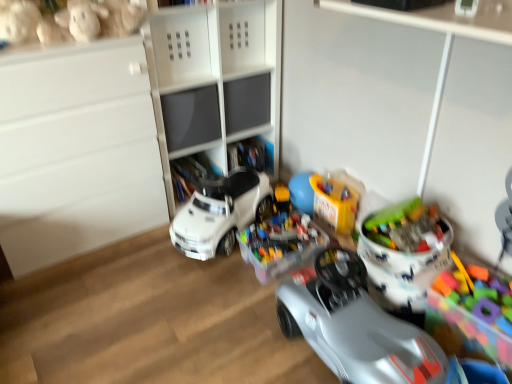
Question: Is translucent plastic toy at center right, positioned as the 2th toy in right-to-left order, facing away from white matte cabinet at upper center, which appears as the 1th shelf when viewed from the top?

Choices:
 (A) no
 (B) yes

Answer: (A)

Question: Can you confirm if translucent plastic toy at center right, acting as the 6th toy starting from the left, is wider than white matte cabinet at upper center, positioned as the 2th shelf in bottom-to-top order?

Choices:
 (A) no
 (B) yes

Answer: (A)

Question: Is translucent plastic toy at center right, acting as the 6th toy starting from the left, to the right of white matte cabinet at upper center, positioned as the 2th shelf in bottom-to-top order, from the viewer's perspective?

Choices:
 (A) yes
 (B) no

Answer: (A)

Question: From a real-world perspective, is translucent plastic toy at center right, acting as the 6th toy starting from the left, positioned over white matte cabinet at upper center, positioned as the 2th shelf in bottom-to-top order, based on gravity?

Choices:
 (A) no
 (B) yes

Answer: (A)

Question: From the image's perspective, is translucent plastic toy at center right, acting as the 6th toy starting from the left, above white matte cabinet at upper center, positioned as the 2th shelf in bottom-to-top order?

Choices:
 (A) yes
 (B) no

Answer: (B)

Question: Is translucent plastic toy at center right, acting as the 6th toy starting from the left, positioned behind white matte cabinet at upper center, positioned as the 2th shelf in bottom-to-top order?

Choices:
 (A) no
 (B) yes

Answer: (A)

Question: Considering the relative sizes of fluffy beige teddy bear at upper left, the 2th toy viewed from the left, and shiny plastic toy car at center in the image provided, is fluffy beige teddy bear at upper left, the 2th toy viewed from the left, bigger than shiny plastic toy car at center?

Choices:
 (A) yes
 (B) no

Answer: (B)

Question: Is fluffy beige teddy bear at upper left, acting as the 6th toy starting from the right, at the right side of shiny plastic toy car at center?

Choices:
 (A) yes
 (B) no

Answer: (B)

Question: Is fluffy beige teddy bear at upper left, the 2th toy viewed from the left, wider than shiny plastic toy car at center?

Choices:
 (A) yes
 (B) no

Answer: (A)

Question: From the image's perspective, is fluffy beige teddy bear at upper left, the 2th toy viewed from the left, on shiny plastic toy car at center?

Choices:
 (A) no
 (B) yes

Answer: (B)

Question: Can you confirm if fluffy beige teddy bear at upper left, the 2th toy viewed from the left, is thinner than shiny plastic toy car at center?

Choices:
 (A) no
 (B) yes

Answer: (A)

Question: Is fluffy beige teddy bear at upper left, acting as the 6th toy starting from the right, at the left side of shiny plastic toy car at center?

Choices:
 (A) yes
 (B) no

Answer: (A)

Question: Is multicolored plastic blocks at right, which is counted as the 1th toy, starting from the right, at the left side of shiny plastic toy car at center?

Choices:
 (A) yes
 (B) no

Answer: (B)